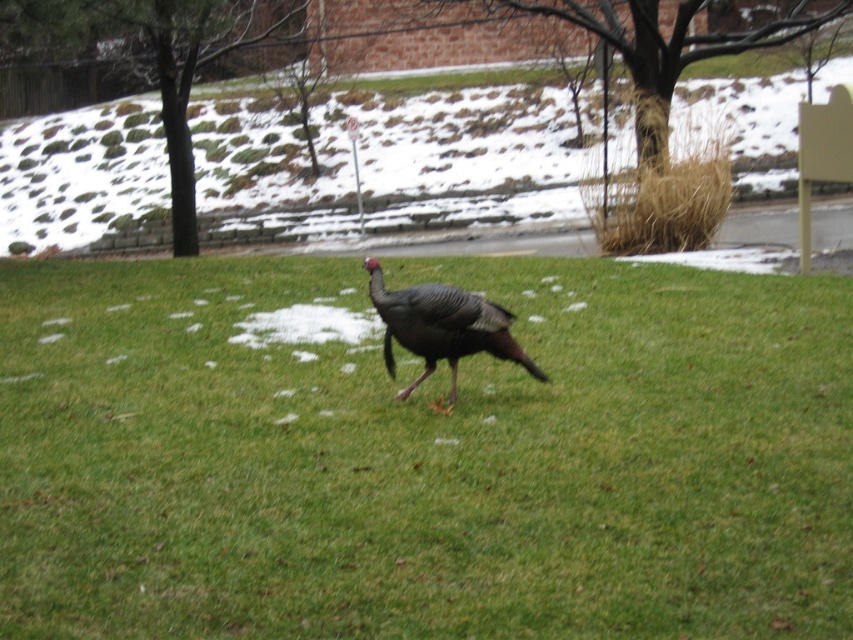
Question: Does green grass at center appear on the right side of gray matte turkey at center?

Choices:
 (A) yes
 (B) no

Answer: (B)

Question: Is the position of green grass at center more distant than that of gray matte turkey at center?

Choices:
 (A) no
 (B) yes

Answer: (A)

Question: Can you confirm if green grass at center is positioned above gray matte turkey at center?

Choices:
 (A) no
 (B) yes

Answer: (A)

Question: Which point appears closest to the camera in this image?

Choices:
 (A) (442, 326)
 (B) (432, 548)

Answer: (B)

Question: Which point is farther to the camera?

Choices:
 (A) (587, 465)
 (B) (532, 372)

Answer: (B)

Question: Among these points, which one is nearest to the camera?

Choices:
 (A) (413, 422)
 (B) (492, 328)

Answer: (A)